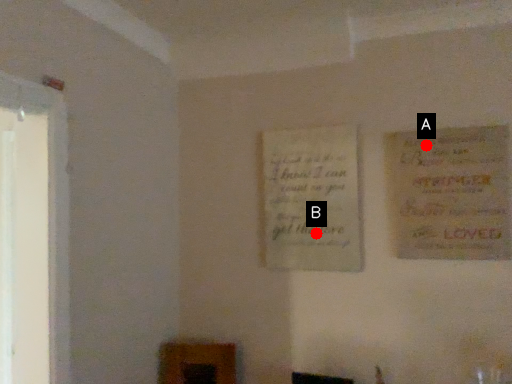
Question: Two points are circled on the image, labeled by A and B beside each circle. Which of the following is the farthest from the observer?

Choices:
 (A) A is further
 (B) B is further

Answer: (B)